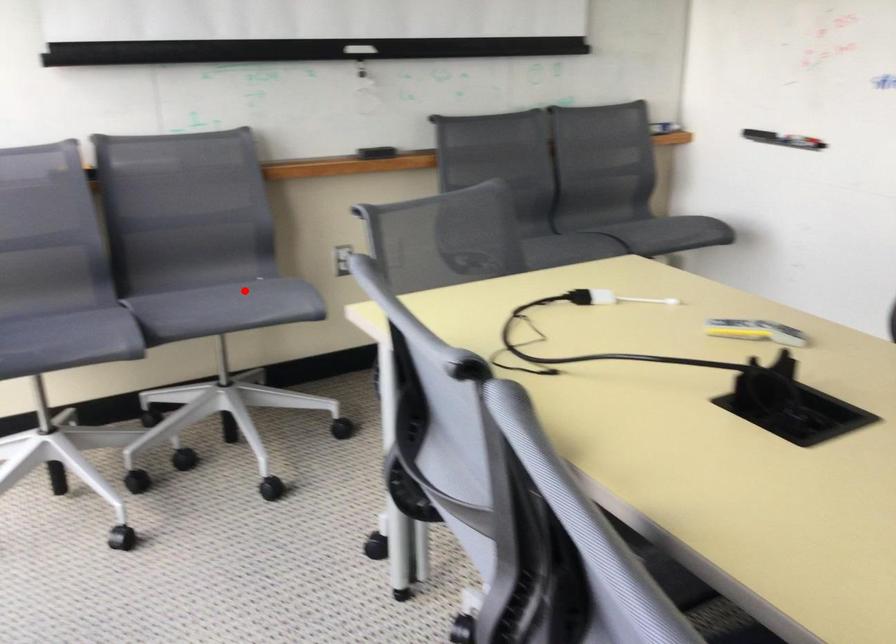
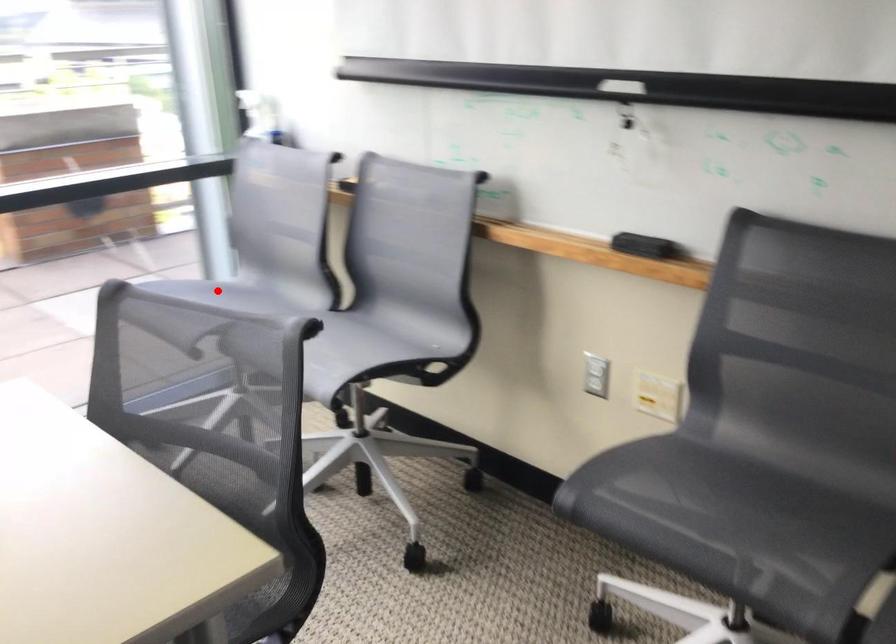
I am providing you with two images of the same scene from different viewpoints. A red point is marked on the first image and another point is marked on the second image. Are the points marked in image1 and image2 representing the same 3D position?

No